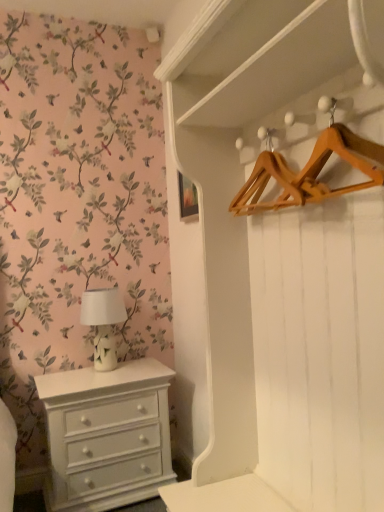
I want to click on free point above white painted wood chest of drawers at lower left (from a real-world perspective), so click(99, 372).